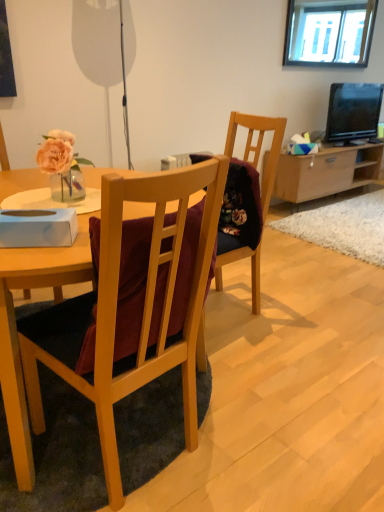
Question: Visually, is wooden chair at center positioned to the left or to the right of wooden chair at center?

Choices:
 (A) right
 (B) left

Answer: (A)

Question: From their relative heights in the image, would you say wooden chair at center is taller or shorter than wooden chair at center?

Choices:
 (A) short
 (B) tall

Answer: (B)

Question: Estimate the real-world distances between objects in this image. Which object is farther from the wooden chair at center?

Choices:
 (A) wooden chair at center
 (B) clear glass window at upper center
 (C) matte black television at upper right
 (D) light brown wood cabinet at center right

Answer: (B)

Question: Which of these objects is positioned closest to the matte black television at upper right?

Choices:
 (A) wooden chair at center
 (B) wooden chair at center
 (C) light brown wood cabinet at center right
 (D) clear glass window at upper center

Answer: (C)